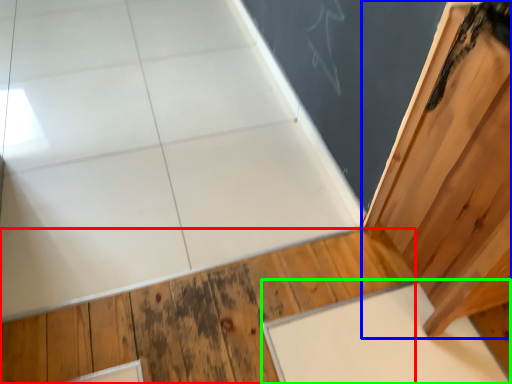
Question: Based on their relative distances, which object is farther from hardwood (highlighted by a red box)? Choose from door (highlighted by a blue box) and slate (highlighted by a green box).

Choices:
 (A) door
 (B) slate

Answer: (A)